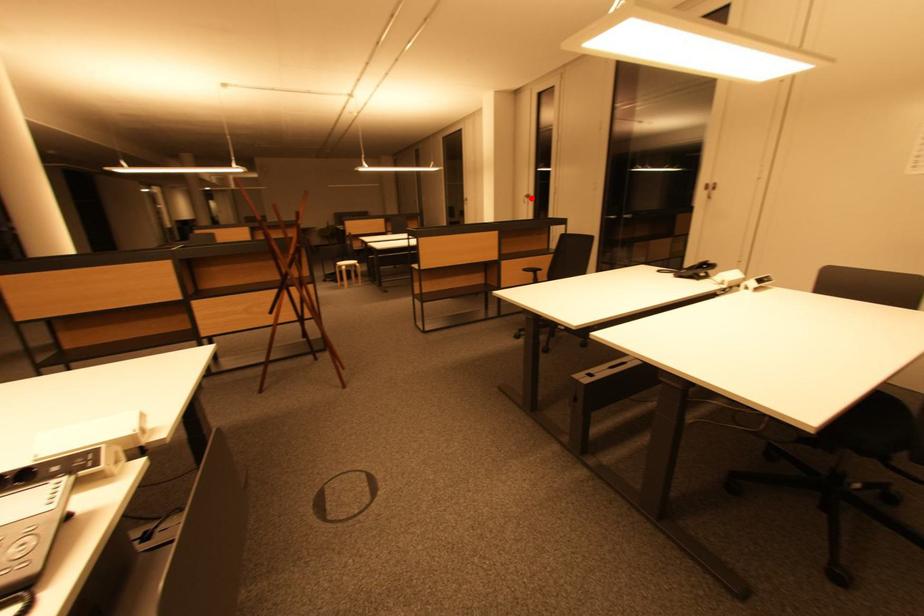
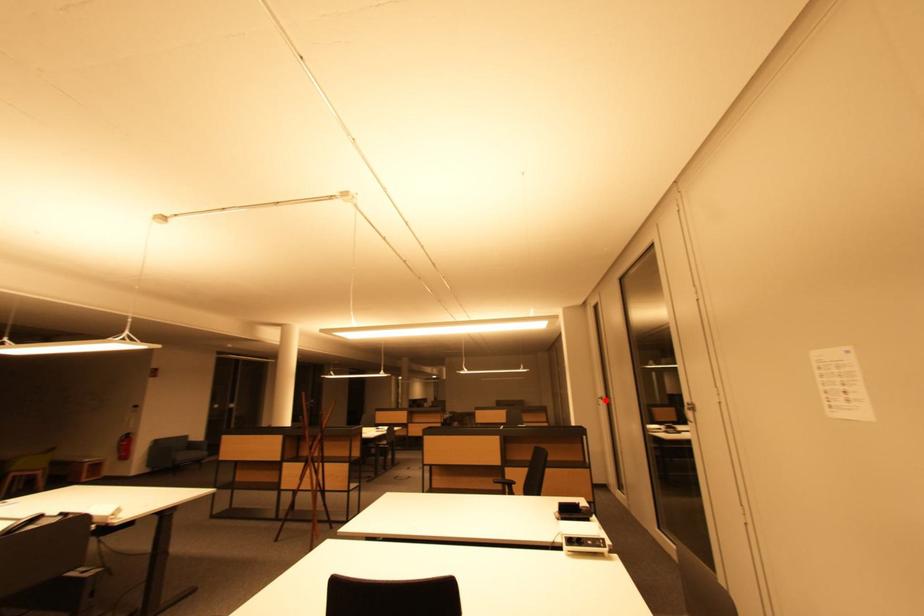
I am providing you with two images of the same scene from different viewpoints. A red point is marked on the first image and another point is marked on the second image. Are the points marked in image1 and image2 representing the same 3D position?

Yes